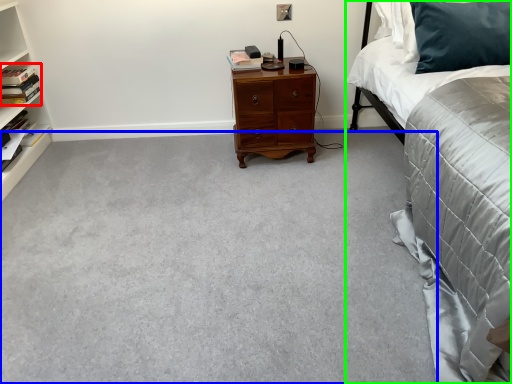
Question: Based on their relative distances, which object is nearer to book (highlighted by a red box)? Choose from plain (highlighted by a blue box) and bed (highlighted by a green box).

Choices:
 (A) plain
 (B) bed

Answer: (A)